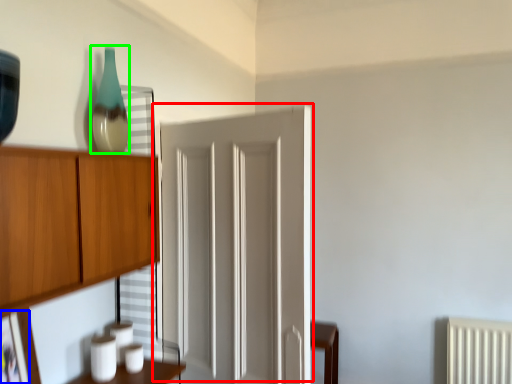
Question: Which object is the farthest from door (highlighted by a red box)? Choose among these: picture frame (highlighted by a blue box) or glass vase (highlighted by a green box).

Choices:
 (A) picture frame
 (B) glass vase

Answer: (A)